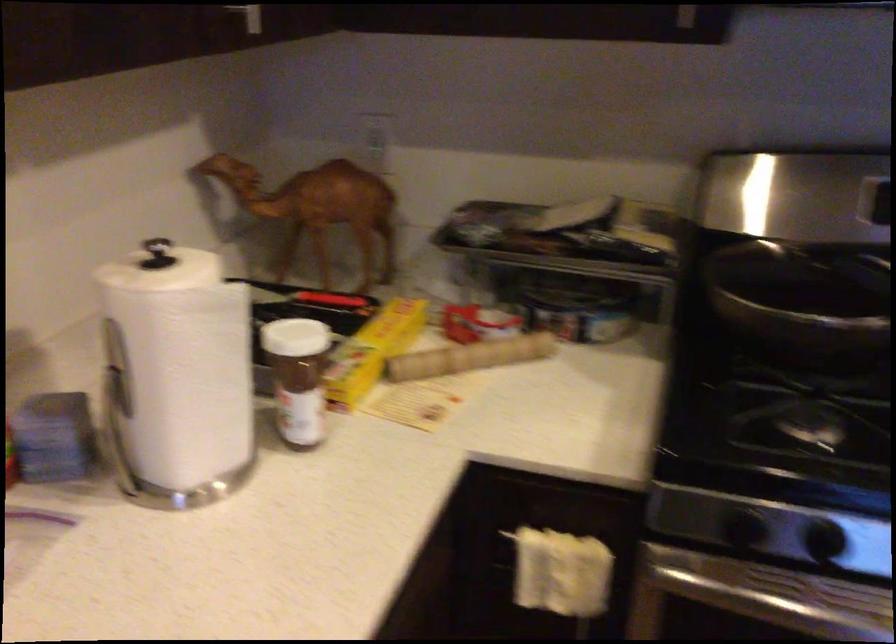
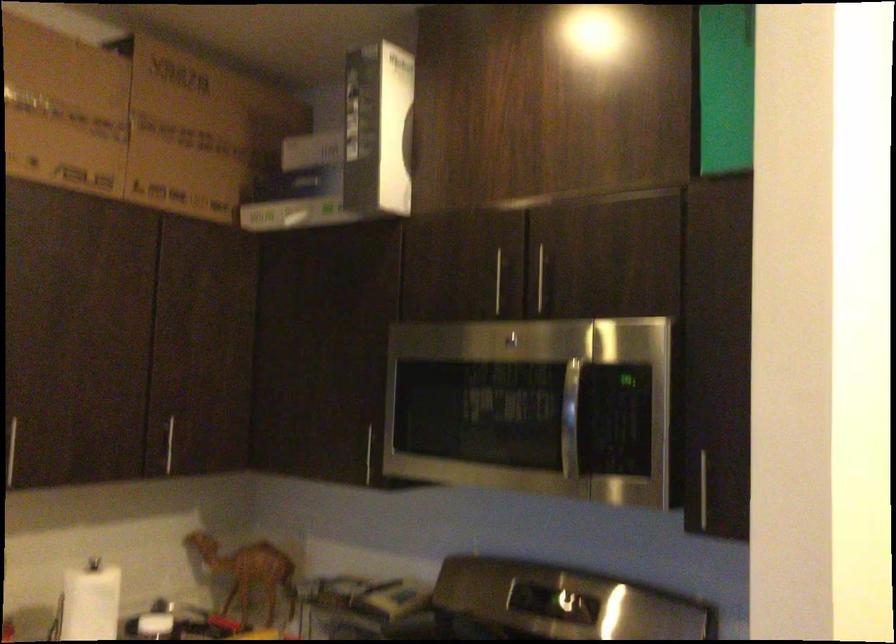
Question: I am providing you with two images of the same scene from different viewpoints. Which of the following objects are not visible in image2?

Choices:
 (A) microwave door handle
 (B) paper towel holder knob
 (C) large cardboard box
 (D) black webcam

Answer: (B)